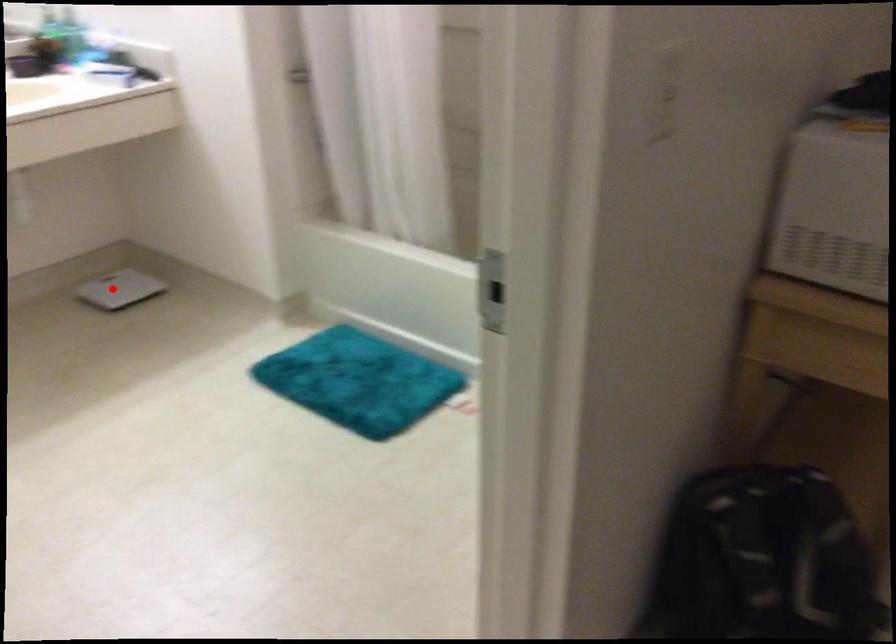
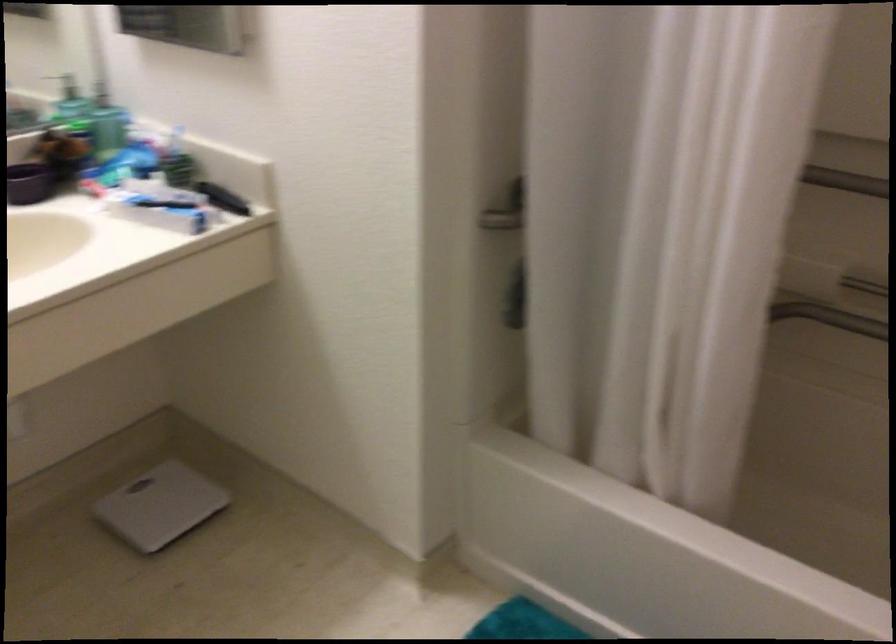
Find the pixel in the second image that matches the highlighted location in the first image.

(159, 506)